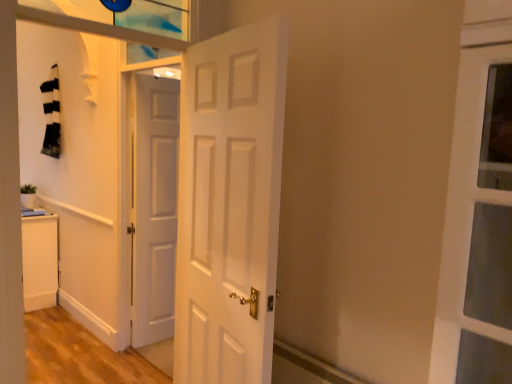
What do you see at coordinates (154, 208) in the screenshot?
I see `white matte door at center, the 1th door in the left-to-right sequence` at bounding box center [154, 208].

Describe the element at coordinates (229, 204) in the screenshot. I see `white matte door at center, the 1th door from the right` at that location.

Locate an element on the screen. The width and height of the screenshot is (512, 384). white matte cabinet at lower left is located at coordinates (40, 261).

Locate an element on the screen. door behind the white matte door at center, the second door in the left-to-right sequence is located at coordinates (154, 208).

In the scene shown: Is white matte door at center, which is counted as the 1th door, starting from the front, situated inside white matte door at center, which is the 2th door in right-to-left order, or outside?

white matte door at center, which is counted as the 1th door, starting from the front, lies outside white matte door at center, which is the 2th door in right-to-left order.

Can you see white matte door at center, which is counted as the 1th door, starting from the front, touching white matte door at center, the 1th door in the left-to-right sequence?

No, white matte door at center, which is counted as the 1th door, starting from the front, is not touching white matte door at center, the 1th door in the left-to-right sequence.

Is white matte door at center, acting as the 2th door starting from the back, wider or thinner than white matte door at center, which is the 2th door in right-to-left order?

white matte door at center, acting as the 2th door starting from the back, is wider than white matte door at center, which is the 2th door in right-to-left order.

How different are the orientations of white matte door at center, the 1th door in the left-to-right sequence, and white matte cabinet at lower left in degrees?

84.4 degrees separate the facing orientations of white matte door at center, the 1th door in the left-to-right sequence, and white matte cabinet at lower left.

Is there a large distance between white matte door at center, which is the 2th door in right-to-left order, and white matte cabinet at lower left?

That's right, there is a large distance between white matte door at center, which is the 2th door in right-to-left order, and white matte cabinet at lower left.

Which object is thinner, white matte door at center, which is the 2th door in right-to-left order, or white matte cabinet at lower left?

white matte door at center, which is the 2th door in right-to-left order.

Does point (139, 186) appear closer or farther from the camera than point (44, 247)?

Point (139, 186) is closer to the camera than point (44, 247).

Looking at this image, is the depth of white matte cabinet at lower left less than that of white matte door at center, positioned as the second door in front-to-back order?

No, white matte cabinet at lower left is behind white matte door at center, positioned as the second door in front-to-back order.

Who is bigger, white matte cabinet at lower left or white matte door at center, the 1th door in the left-to-right sequence?

white matte cabinet at lower left.

You are a GUI agent. You are given a task and a screenshot of the screen. Output one action in this format:
    pyautogui.click(x=<x>, y=<y>)
    Task: Click on the cabinetry behind the white matte door at center, positioned as the second door in front-to-back order
    
    Given the screenshot: What is the action you would take?
    pyautogui.click(x=40, y=261)

Considering the points (33, 264) and (139, 337), which point is behind, point (33, 264) or point (139, 337)?

The point (33, 264) is behind.

Is point (52, 273) more distant than point (21, 197)?

Yes, it is.

Considering the sizes of objects white matte cabinet at lower left and green matte plant at lower left in the image provided, who is smaller, white matte cabinet at lower left or green matte plant at lower left?

green matte plant at lower left.

Is white matte cabinet at lower left positioned behind green matte plant at lower left?

No, white matte cabinet at lower left is in front of green matte plant at lower left.

From the image's perspective, is white matte cabinet at lower left located above or below green matte plant at lower left?

Based on their image positions, white matte cabinet at lower left is located beneath green matte plant at lower left.

What are the coordinates of `door on the left of white matte door at center, acting as the 2th door starting from the back` in the screenshot? It's located at (154, 208).

Is white matte door at center, which is the 2th door in right-to-left order, looking in the opposite direction of white matte door at center, which is counted as the 1th door, starting from the front?

No, white matte door at center, which is the 2th door in right-to-left order,'s orientation is not away from white matte door at center, which is counted as the 1th door, starting from the front.

Considering the positions of objects white matte door at center, positioned as the second door in front-to-back order, and white matte door at center, which is counted as the 1th door, starting from the front, in the image provided, who is more to the right, white matte door at center, positioned as the second door in front-to-back order, or white matte door at center, which is counted as the 1th door, starting from the front,?

white matte door at center, which is counted as the 1th door, starting from the front.

From a real-world perspective, is green matte plant at lower left physically located above or below white matte door at center, which is the 2th door in right-to-left order?

Clearly, from a real-world perspective, green matte plant at lower left is below white matte door at center, which is the 2th door in right-to-left order.

Looking at this image, is the depth of green matte plant at lower left less than that of white matte door at center, which appears as the 1th door when viewed from the back?

No, green matte plant at lower left is further to the viewer.

Is point (25, 207) closer or farther from the camera than point (155, 137)?

Point (25, 207) is positioned farther from the camera compared to point (155, 137).

Is green matte plant at lower left outside of white matte door at center, which is the 2th door in right-to-left order?

Yes, green matte plant at lower left is located beyond the bounds of white matte door at center, which is the 2th door in right-to-left order.

Would you say white matte door at center, the 1th door from the right, is to the left or to the right of white matte cabinet at lower left in the picture?

Clearly, white matte door at center, the 1th door from the right, is on the right of white matte cabinet at lower left in the image.

Is white matte cabinet at lower left inside white matte door at center, the second door in the left-to-right sequence?

No, white matte cabinet at lower left is not a part of white matte door at center, the second door in the left-to-right sequence.

Which of these two, white matte door at center, acting as the 2th door starting from the back, or white matte cabinet at lower left, is thinner?

With smaller width is white matte door at center, acting as the 2th door starting from the back.

At what (x,y) coordinates should I click in order to perform the action: click on door on the left of the white matte door at center, acting as the 2th door starting from the back. Please return your answer as a coordinate pair (x, y). This screenshot has height=384, width=512. Looking at the image, I should click on (154, 208).

Where is `door that is the 1st object above the white matte cabinet at lower left (from a real-world perspective)`? The image size is (512, 384). door that is the 1st object above the white matte cabinet at lower left (from a real-world perspective) is located at coordinates (154, 208).

Which object lies further to the anchor point white matte cabinet at lower left, white matte door at center, positioned as the second door in front-to-back order, or green matte plant at lower left?

Among the two, white matte door at center, positioned as the second door in front-to-back order, is located further to white matte cabinet at lower left.

Based on their spatial positions, is white matte door at center, which is counted as the 1th door, starting from the front, or white matte door at center, which is the 2th door in right-to-left order, further from green matte plant at lower left?

white matte door at center, which is counted as the 1th door, starting from the front, lies further to green matte plant at lower left than the other object.

Considering their positions, is white matte cabinet at lower left positioned closer to green matte plant at lower left than white matte door at center, which is the 2th door in right-to-left order?

white matte cabinet at lower left is positioned closer to the anchor green matte plant at lower left.

Looking at this image, when comparing their distances from green matte plant at lower left, does white matte door at center, which appears as the 1th door when viewed from the back, or white matte cabinet at lower left seem closer?

The object closer to green matte plant at lower left is white matte cabinet at lower left.

Considering their positions, is green matte plant at lower left positioned further to white matte door at center, which is the 2th door in right-to-left order, than white matte door at center, which is counted as the 1th door, starting from the front?

Among the two, green matte plant at lower left is located further to white matte door at center, which is the 2th door in right-to-left order.

Consider the image. Estimate the real-world distances between objects in this image. Which object is further from white matte door at center, positioned as the second door in front-to-back order, green matte plant at lower left or white matte cabinet at lower left?

green matte plant at lower left lies further to white matte door at center, positioned as the second door in front-to-back order, than the other object.

Considering their positions, is green matte plant at lower left positioned further to white matte cabinet at lower left than white matte door at center, the 1th door from the right?

Among the two, white matte door at center, the 1th door from the right, is located further to white matte cabinet at lower left.

Considering their positions, is white matte door at center, which appears as the 1th door when viewed from the back, positioned further to white matte door at center, acting as the 2th door starting from the back, than green matte plant at lower left?

The object further to white matte door at center, acting as the 2th door starting from the back, is green matte plant at lower left.

Where is `door located between white matte door at center, acting as the 2th door starting from the back, and white matte cabinet at lower left in the depth direction`? door located between white matte door at center, acting as the 2th door starting from the back, and white matte cabinet at lower left in the depth direction is located at coordinates (154, 208).

The height and width of the screenshot is (384, 512). In order to click on houseplant situated between white matte cabinet at lower left and white matte door at center, which is the 2th door in right-to-left order, from left to right in this screenshot , I will do [28, 196].

At what (x,y) coordinates should I click in order to perform the action: click on door between white matte door at center, the second door in the left-to-right sequence, and green matte plant at lower left in the front-back direction. Please return your answer as a coordinate pair (x, y). Image resolution: width=512 pixels, height=384 pixels. Looking at the image, I should click on (154, 208).

At what (x,y) coordinates should I click in order to perform the action: click on cabinetry between white matte door at center, acting as the 2th door starting from the back, and green matte plant at lower left from front to back. Please return your answer as a coordinate pair (x, y). The image size is (512, 384). Looking at the image, I should click on (40, 261).